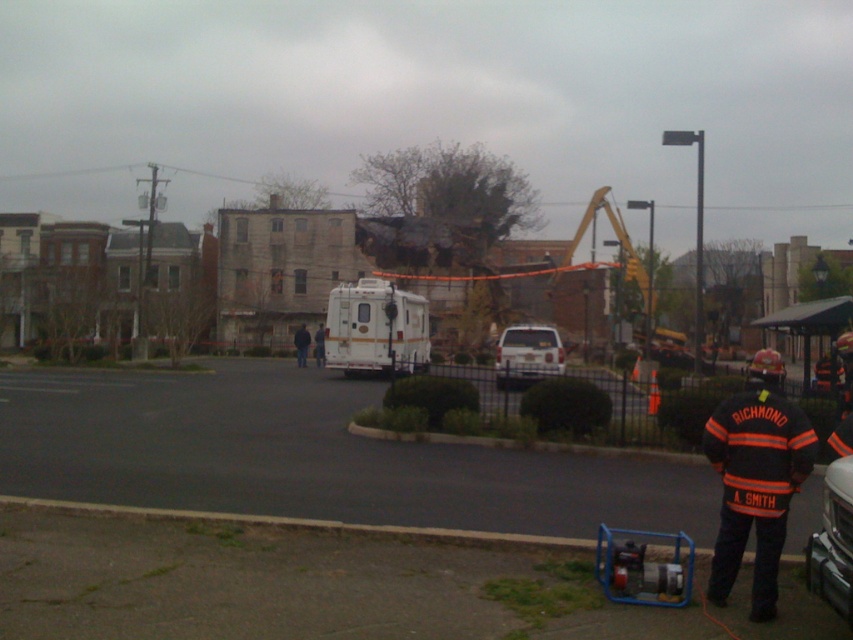
You are a drone operator trying to capture aerial footage of the disaster area. You notice two points in the scene at coordinates point (x=751, y=372) and point (x=300, y=358). Which point is closer to your drone camera lens?

Point (x=751, y=372) is closer to the camera than point (x=300, y=358).

You are a delivery driver who needs to drop off a package at the collapsed building. There is an orange reflective jacket at lower right. Where exactly is the orange reflective jacket located in the image?

The orange reflective jacket at lower right is located at point (756, 477) in the image.

You are a drone operator trying to locate a specific point in an urban scene. The scene includes a blue generator on the ground and a white postal truck parked on the street. Where would you find the point at coordinates (756,477)?

The point at coordinates (756,477) is located on the orange reflective jacket at lower right.